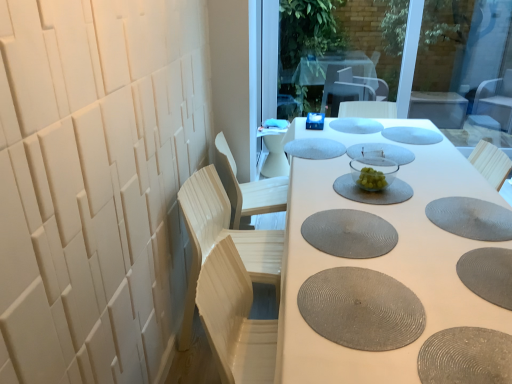
You are a GUI agent. You are given a task and a screenshot of the screen. Output one action in this format:
    pyautogui.click(x=<x>, y=<y>)
    Task: Click on the vacant region in front of light blue fabric cushion at center, placed as the 8th manhole cover when sorted from front to back
    This screenshot has height=384, width=512.
    Given the screenshot: What is the action you would take?
    pyautogui.click(x=325, y=166)